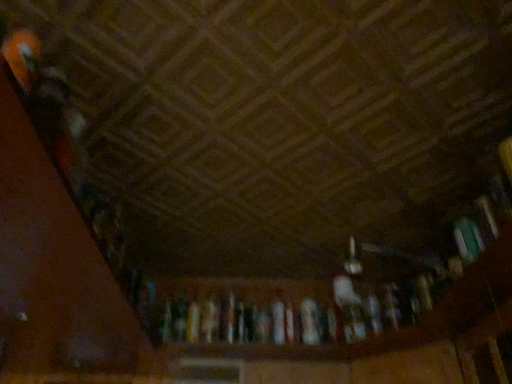
Question: From the image's perspective, is white paper book at center, which is counted as the 1th book, starting from the back, above or below teal matte book at right, which appears as the 1th book when viewed from the front?

Choices:
 (A) below
 (B) above

Answer: (A)

Question: Is white paper book at center, which is counted as the 1th book, starting from the back, bigger or smaller than teal matte book at right, which appears as the 1th book when viewed from the top?

Choices:
 (A) big
 (B) small

Answer: (B)

Question: From their relative heights in the image, would you say white paper book at center, which is counted as the 2th book, starting from the right, is taller or shorter than teal matte book at right, which is the second book in bottom-to-top order?

Choices:
 (A) short
 (B) tall

Answer: (A)

Question: Considering the positions of teal matte book at right, which is counted as the 1th book, starting from the right, and white paper book at center, the first book viewed from the left, in the image, is teal matte book at right, which is counted as the 1th book, starting from the right, bigger or smaller than white paper book at center, the first book viewed from the left,?

Choices:
 (A) big
 (B) small

Answer: (A)

Question: Is teal matte book at right, which is the second book in bottom-to-top order, in front of or behind white paper book at center, the first book viewed from the left, in the image?

Choices:
 (A) front
 (B) behind

Answer: (A)

Question: Considering the positions of teal matte book at right, which is counted as the 1th book, starting from the right, and white paper book at center, which is counted as the 1th book, starting from the back, in the image, is teal matte book at right, which is counted as the 1th book, starting from the right, wider or thinner than white paper book at center, which is counted as the 1th book, starting from the back,?

Choices:
 (A) thin
 (B) wide

Answer: (B)

Question: From the image's perspective, is teal matte book at right, which appears as the 1th book when viewed from the top, positioned above or below white paper book at center, the 2th book in the top-to-bottom sequence?

Choices:
 (A) above
 (B) below

Answer: (A)